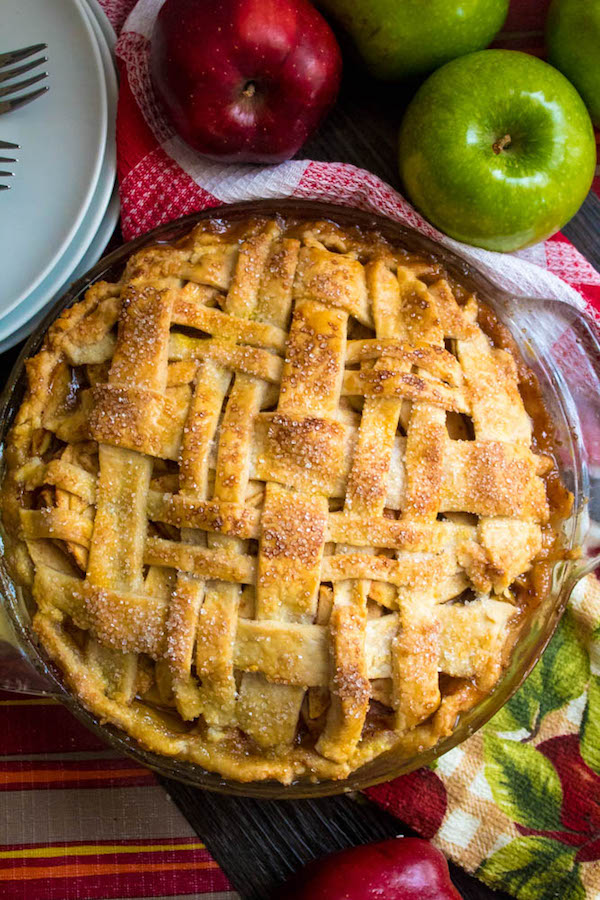
Find the location of `striped multi-color table cloth`. striped multi-color table cloth is located at coordinates (147, 852), (50, 758), (56, 838).